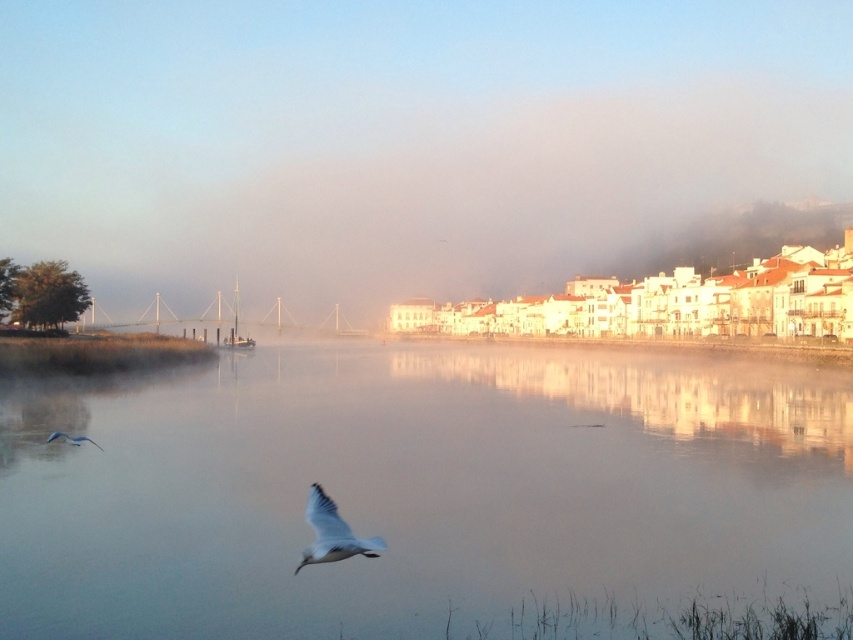
Who is taller, foggy mist at center or white matte bird at lower left?

With more height is foggy mist at center.

Consider the image. Between foggy mist at center and white matte bird at lower left, which one has less height?

With less height is white matte bird at lower left.

This screenshot has width=853, height=640. I want to click on foggy mist at center, so click(x=401, y=138).

Which is below, white matte bird at lower center or metallic gray boat at center?

white matte bird at lower center is lower down.

Which is more to the left, white matte bird at lower center or metallic gray boat at center?

metallic gray boat at center

What do you see at coordinates (332, 532) in the screenshot? The width and height of the screenshot is (853, 640). I see `white matte bird at lower center` at bounding box center [332, 532].

Locate an element on the screen. white matte bird at lower center is located at coordinates (332, 532).

Is foggy mist at center positioned at the back of metallic gray boat at center?

Yes.

Find the location of a particular element. This screenshot has height=640, width=853. foggy mist at center is located at coordinates (401, 138).

This screenshot has height=640, width=853. I want to click on foggy mist at center, so click(x=401, y=138).